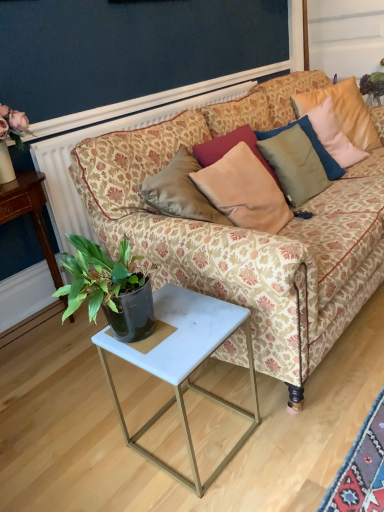
Describe the element at coordinates (295, 162) in the screenshot. I see `satin beige pillow at upper center, the 2th pillow viewed from the right` at that location.

How much space does satin beige pillow at upper center, marked as the 2th pillow in a left-to-right arrangement, occupy horizontally?

The width of satin beige pillow at upper center, marked as the 2th pillow in a left-to-right arrangement, is 4.70 inches.

At what (x,y) coordinates should I click in order to perform the action: click on white marble table at lower left. Please return your answer as a coordinate pair (x, y). Looking at the image, I should click on (29, 212).

This screenshot has height=512, width=384. Describe the element at coordinates (343, 111) in the screenshot. I see `velvet beige pillow at upper right, placed as the first pillow when sorted from right to left` at that location.

The image size is (384, 512). Find the location of `velvet beige pillow at upper right, arranged as the third pillow when viewed from the left`. velvet beige pillow at upper right, arranged as the third pillow when viewed from the left is located at coordinates (343, 111).

What is the approximate width of white marble side table at lower center?

The width of white marble side table at lower center is 15.26 inches.

Describe the element at coordinates (247, 231) in the screenshot. The height and width of the screenshot is (512, 384). I see `patterned fabric couch at center` at that location.

Locate an element on the screen. The height and width of the screenshot is (512, 384). satin beige pillow at upper center, marked as the 2th pillow in a left-to-right arrangement is located at coordinates (295, 162).

Considering the relative positions of white marble table at lower left and velvet beige pillow at upper right, arranged as the third pillow when viewed from the left, in the image provided, is white marble table at lower left to the right of velvet beige pillow at upper right, arranged as the third pillow when viewed from the left, from the viewer's perspective?

No, white marble table at lower left is not to the right of velvet beige pillow at upper right, arranged as the third pillow when viewed from the left.

Is white marble table at lower left far from velvet beige pillow at upper right, arranged as the third pillow when viewed from the left?

white marble table at lower left is far away from velvet beige pillow at upper right, arranged as the third pillow when viewed from the left.

Is the depth of white marble table at lower left less than that of velvet beige pillow at upper right, placed as the first pillow when sorted from right to left?

Yes, the depth of white marble table at lower left is less than that of velvet beige pillow at upper right, placed as the first pillow when sorted from right to left.

From the image's perspective, which object appears higher, white marble table at lower left or velvet beige pillow at upper right, arranged as the third pillow when viewed from the left?

velvet beige pillow at upper right, arranged as the third pillow when viewed from the left, from the image's perspective.

How much distance is there between white marble side table at lower center and satin beige pillow at center, the 3th pillow viewed from the right?

white marble side table at lower center and satin beige pillow at center, the 3th pillow viewed from the right, are 21.33 inches apart.

From a real-world perspective, who is located lower, white marble side table at lower center or satin beige pillow at center, the 1th pillow in the left-to-right sequence?

white marble side table at lower center is physically lower.

Are white marble side table at lower center and satin beige pillow at center, the 1th pillow in the left-to-right sequence, beside each other?

No.

Would you say patterned fabric couch at center is inside or outside dark blue wall at upper center?

patterned fabric couch at center lies outside dark blue wall at upper center.

Is patterned fabric couch at center next to dark blue wall at upper center and touching it?

patterned fabric couch at center and dark blue wall at upper center are clearly separated.

Is patterned fabric couch at center at the right side of dark blue wall at upper center?

Yes.

Does dark blue wall at upper center contain patterned fabric couch at center?

No.

Is dark blue wall at upper center taller than patterned fabric couch at center?

In fact, dark blue wall at upper center may be shorter than patterned fabric couch at center.

Which point is more forward, (172, 92) or (173, 252)?

Point (173, 252)

Find the location of `desk located below the dark blue wall at upper center (from the image's perspective)`. desk located below the dark blue wall at upper center (from the image's perspective) is located at coordinates (29, 212).

Can you confirm if white marble table at lower left is positioned to the left of dark blue wall at upper center?

Indeed, white marble table at lower left is positioned on the left side of dark blue wall at upper center.

Is white marble table at lower left positioned with its back to dark blue wall at upper center?

white marble table at lower left does not have its back to dark blue wall at upper center.

From a real-world perspective, which object stands above the other?

dark blue wall at upper center is physically above.

Which is correct: green leafy plant at upper right is inside white marble table at lower left, or outside of it?

green leafy plant at upper right exists outside the volume of white marble table at lower left.

Measure the distance between green leafy plant at upper right and white marble table at lower left.

The distance of green leafy plant at upper right from white marble table at lower left is 7.23 feet.

From the image's perspective, which object appears higher, green leafy plant at upper right or white marble table at lower left?

green leafy plant at upper right, from the image's perspective.

From a real-world perspective, is green leafy plant at upper right positioned over white marble table at lower left based on gravity?

Yes, from a real-world perspective, green leafy plant at upper right is over white marble table at lower left

Would you say satin beige pillow at center, the 1th pillow in the left-to-right sequence, is outside white marble side table at lower center?

Indeed, satin beige pillow at center, the 1th pillow in the left-to-right sequence, is completely outside white marble side table at lower center.

Does satin beige pillow at center, the 1th pillow in the left-to-right sequence, lie in front of white marble side table at lower center?

No, the depth of satin beige pillow at center, the 1th pillow in the left-to-right sequence, is greater than that of white marble side table at lower center.

Based on the photo, from the image's perspective, which one is positioned lower, satin beige pillow at center, the 1th pillow in the left-to-right sequence, or white marble side table at lower center?

white marble side table at lower center, from the image's perspective.

Where is `desk below the velvet beige pillow at upper right, placed as the first pillow when sorted from right to left (from the image's perspective)`? desk below the velvet beige pillow at upper right, placed as the first pillow when sorted from right to left (from the image's perspective) is located at coordinates (29, 212).

The width and height of the screenshot is (384, 512). What are the coordinates of `the 1st pillow behind the white marble side table at lower center, counting from the anchor's position` in the screenshot? It's located at (244, 191).

Which object lies further to the anchor point white marble side table at lower center, satin beige pillow at center, the 3th pillow viewed from the right, or velvet beige pillow at upper right, placed as the first pillow when sorted from right to left?

The object further to white marble side table at lower center is velvet beige pillow at upper right, placed as the first pillow when sorted from right to left.

From the image, which object appears to be farther from white marble table at lower left, dark blue wall at upper center or satin beige pillow at upper center, marked as the 2th pillow in a left-to-right arrangement?

The object further to white marble table at lower left is satin beige pillow at upper center, marked as the 2th pillow in a left-to-right arrangement.

Looking at the image, which one is located further to green leafy plant at upper right, satin beige pillow at upper center, marked as the 2th pillow in a left-to-right arrangement, or patterned fabric couch at center?

The object further to green leafy plant at upper right is patterned fabric couch at center.

Which object lies nearer to the anchor point patterned fabric couch at center, green leafy plant at upper right or velvet beige pillow at upper right, placed as the first pillow when sorted from right to left?

velvet beige pillow at upper right, placed as the first pillow when sorted from right to left, lies closer to patterned fabric couch at center than the other object.

Consider the image. Looking at the image, which one is located closer to velvet beige pillow at upper right, placed as the first pillow when sorted from right to left, green leafy plant at upper right or white marble table at lower left?

The object closer to velvet beige pillow at upper right, placed as the first pillow when sorted from right to left, is green leafy plant at upper right.

Estimate the real-world distances between objects in this image. Which object is closer to satin beige pillow at center, the 3th pillow viewed from the right, dark blue wall at upper center or white marble side table at lower center?

white marble side table at lower center is positioned closer to the anchor satin beige pillow at center, the 3th pillow viewed from the right.

Based on their spatial positions, is velvet beige pillow at upper right, placed as the first pillow when sorted from right to left, or white marble side table at lower center further from satin beige pillow at upper center, the 2th pillow viewed from the right?

white marble side table at lower center is positioned further to the anchor satin beige pillow at upper center, the 2th pillow viewed from the right.

When comparing their distances from dark blue wall at upper center, does satin beige pillow at center, the 3th pillow viewed from the right, or white marble table at lower left seem further?

satin beige pillow at center, the 3th pillow viewed from the right, is further to dark blue wall at upper center.

Where is `pillow between satin beige pillow at upper center, marked as the 2th pillow in a left-to-right arrangement, and green leafy plant at upper right from front to back`? pillow between satin beige pillow at upper center, marked as the 2th pillow in a left-to-right arrangement, and green leafy plant at upper right from front to back is located at coordinates (343, 111).

The height and width of the screenshot is (512, 384). I want to click on table located between white marble table at lower left and patterned fabric couch at center in the left-right direction, so [x=182, y=362].

The width and height of the screenshot is (384, 512). Find the location of `table located between white marble table at lower left and green leafy plant at upper right in the left-right direction`. table located between white marble table at lower left and green leafy plant at upper right in the left-right direction is located at coordinates (182, 362).

Find the location of a particular element. The width and height of the screenshot is (384, 512). studio couch between dark blue wall at upper center and white marble side table at lower center vertically is located at coordinates (247, 231).